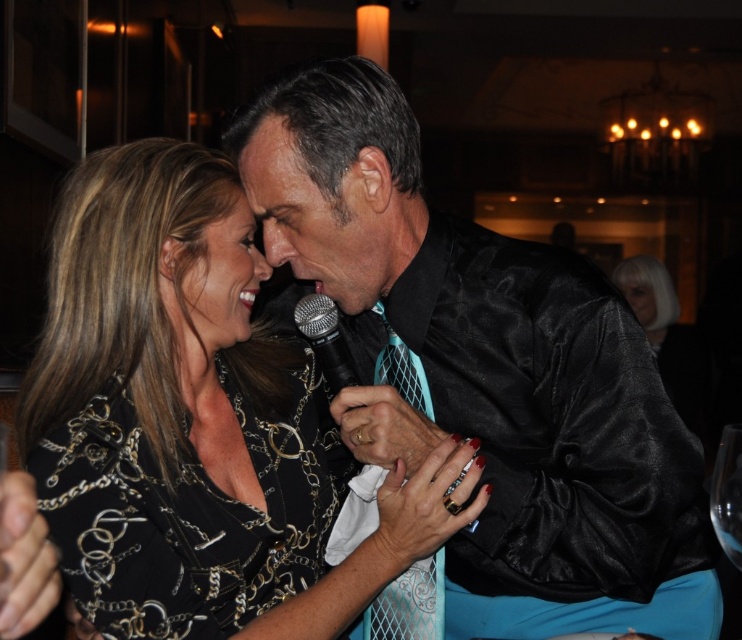
Question: Which point appears closest to the camera in this image?

Choices:
 (A) (441, 602)
 (B) (315, 323)
 (C) (726, 449)
 (D) (341, 84)

Answer: (C)

Question: Is teal mesh tie at center closer to camera compared to black metallic microphone at center?

Choices:
 (A) no
 (B) yes

Answer: (B)

Question: Is teal mesh tie at center bigger than transparent glass at lower right?

Choices:
 (A) no
 (B) yes

Answer: (A)

Question: Which point appears farthest from the camera in this image?

Choices:
 (A) (614, 269)
 (B) (735, 531)
 (C) (531, 252)
 (D) (301, 328)

Answer: (A)

Question: Which point appears farthest from the camera in this image?

Choices:
 (A) (634, 259)
 (B) (111, 500)
 (C) (551, 444)
 (D) (728, 477)

Answer: (A)

Question: Considering the relative positions of silvery metallic jacket at upper right and black metallic microphone at center in the image provided, where is silvery metallic jacket at upper right located with respect to black metallic microphone at center?

Choices:
 (A) left
 (B) right

Answer: (B)